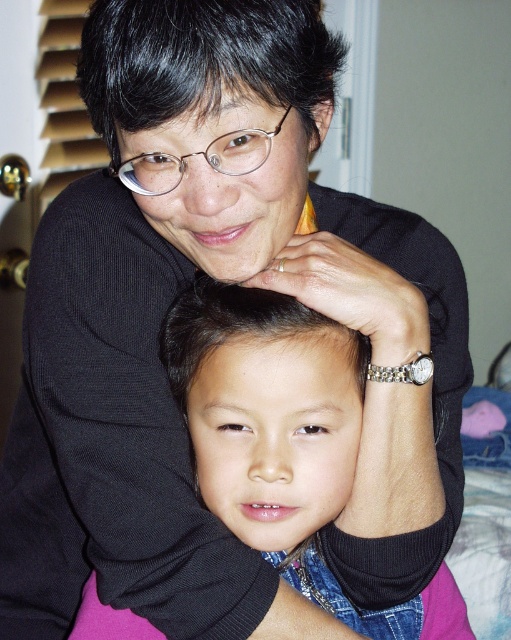
Looking at this image, you are a photographer trying to capture a closeup of the clear plastic glasses at center without including the black shiny hair at center in the frame. Given their sizes, is this possible?

The black shiny hair at center is larger in size than clear plastic glasses at center, so it might be challenging to frame the clear plastic glasses at center without including the black shiny hair at center due to its larger size taking up more space in the image.

Looking at this image, you are a photographer trying to capture the scene. The black shiny hair at center and the clear plastic glasses at center are both in focus. If you want to adjust your camera to focus on an object wider than the other, which one should you choose?

The black shiny hair at center is wider than the clear plastic glasses at center, so you should focus on the black shiny hair at center.

Looking at the scene, which object is higher between the black shiny hair at upper center and the clear plastic glasses at center?

The black shiny hair at upper center is higher than the clear plastic glasses at center.